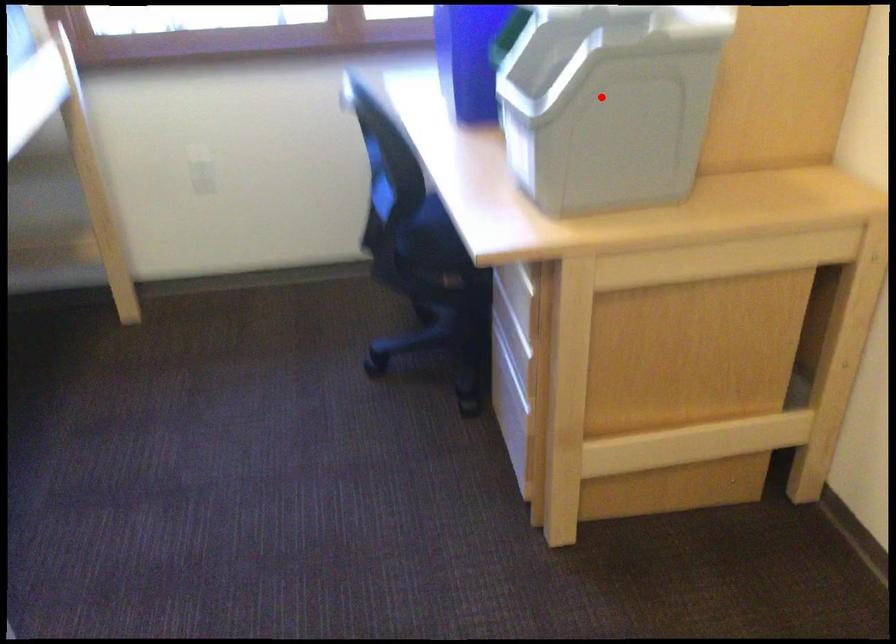
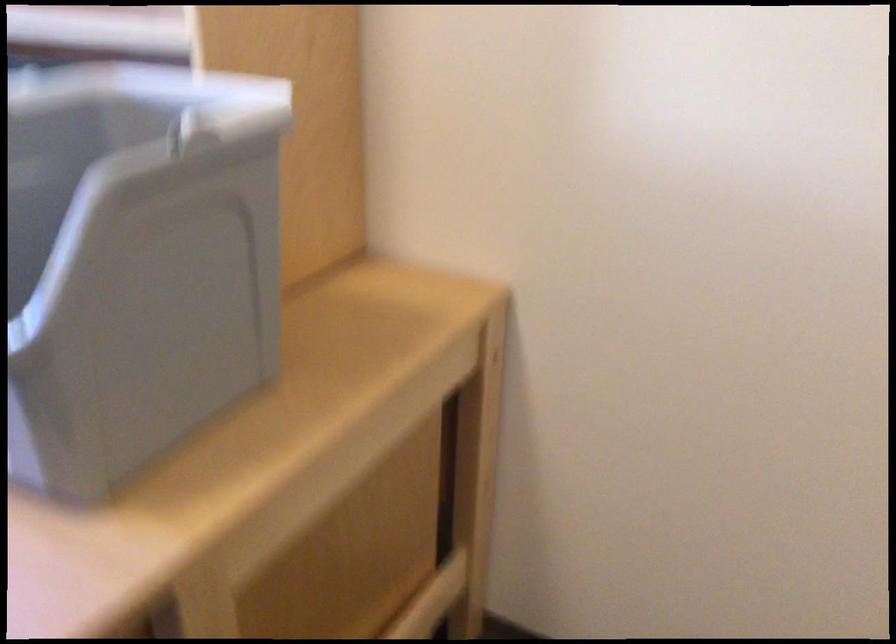
Locate, in the second image, the point that corresponds to the highlighted location in the first image.

(135, 263)